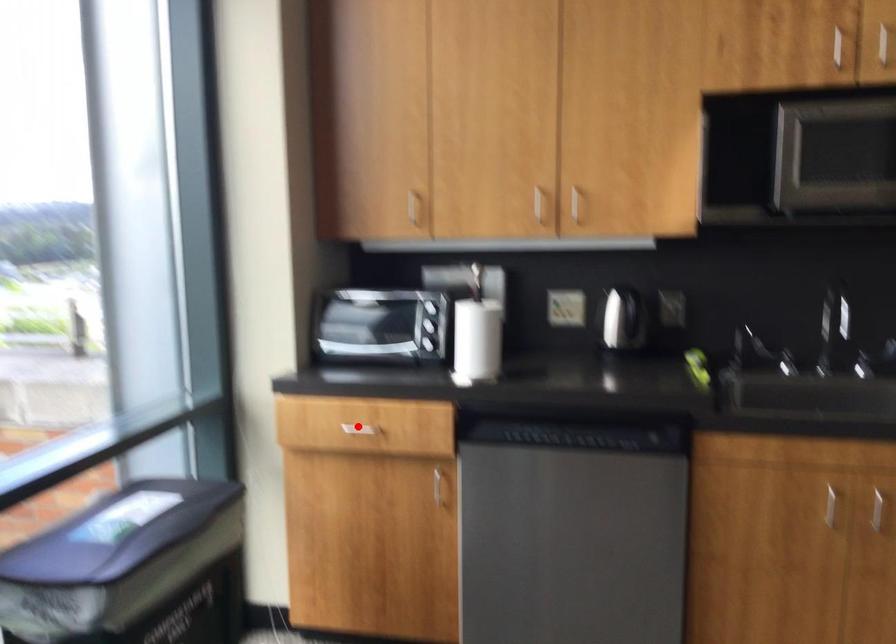
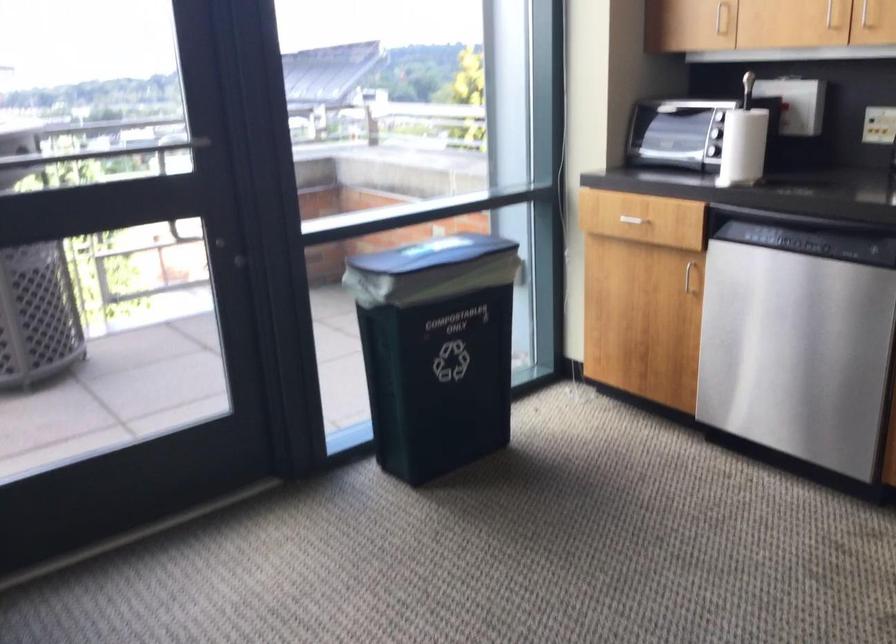
Question: I am providing you with two images of the same scene from different viewpoints. Image1 has a red point marked. In image2, the corresponding 3D location appears at what relative position? Reply with the corresponding letter.

Choices:
 (A) Closer
 (B) Farther

Answer: (B)